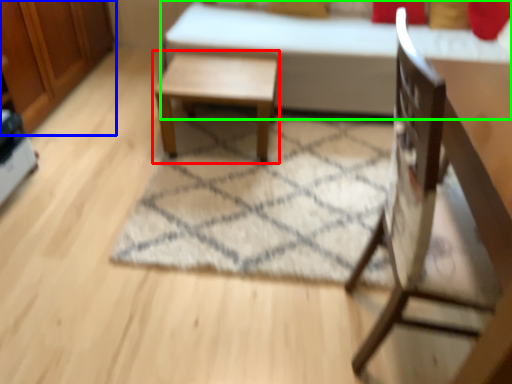
Question: Based on their relative distances, which object is farther from table (highlighted by a red box)? Choose from dresser (highlighted by a blue box) and bed (highlighted by a green box).

Choices:
 (A) dresser
 (B) bed

Answer: (A)